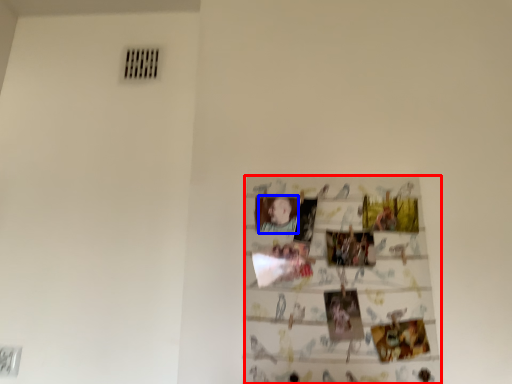
Question: Which of the following is the farthest to the observer, print (highlighted by a red box) or person (highlighted by a blue box)?

Choices:
 (A) print
 (B) person

Answer: (B)